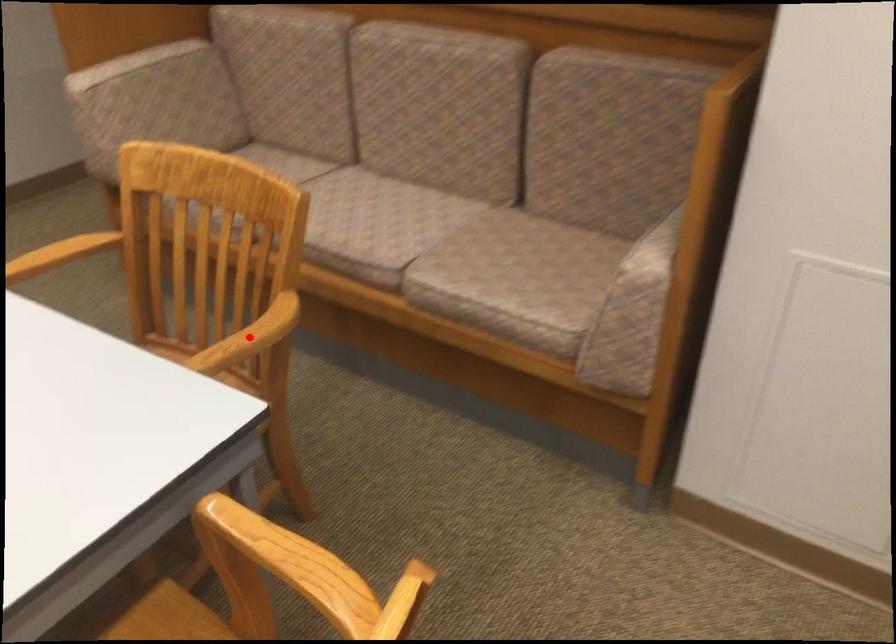
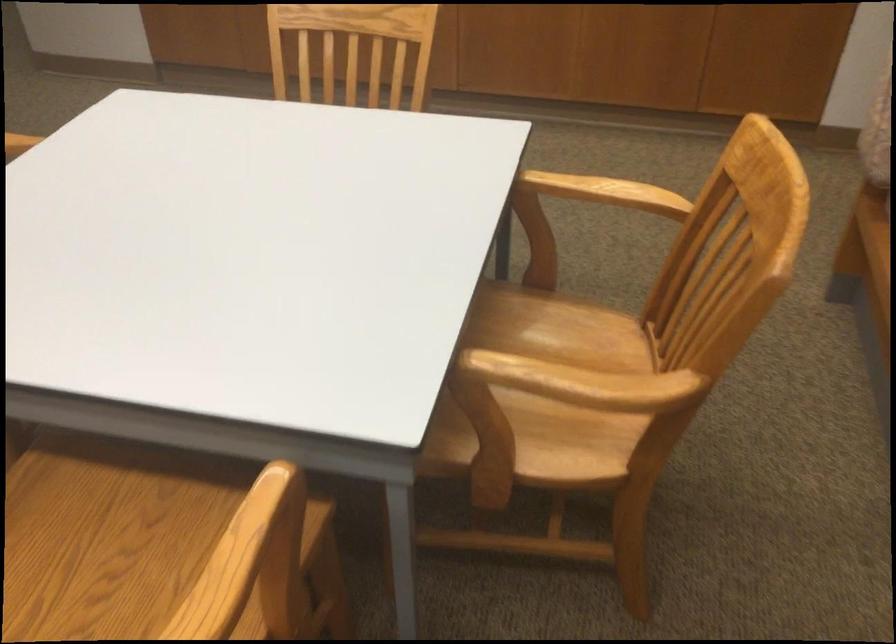
In the second image, find the point that corresponds to the highlighted location in the first image.

(583, 383)